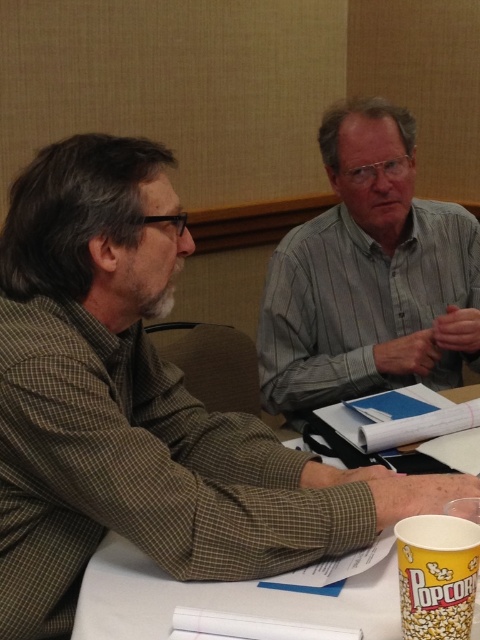
In the scene shown: Who is more distant from viewer, (273, 593) or (468, 627)?

Point (273, 593)

Is point (87, 636) more distant than point (447, 538)?

Yes.

Does point (98, 602) come farther from viewer compared to point (427, 600)?

Yes, it is.

Identify the location of white paper at center. (228, 596).

Can you confirm if gray striped shirt at upper right is wider than white paper at center?

Yes, gray striped shirt at upper right is wider than white paper at center.

Between gray striped shirt at upper right and white paper at center, which one appears on the left side from the viewer's perspective?

From the viewer's perspective, white paper at center appears more on the left side.

Between point (447, 246) and point (242, 604), which one is positioned in front?

Point (242, 604) is in front.

You are a GUI agent. You are given a task and a screenshot of the screen. Output one action in this format:
    pyautogui.click(x=<x>, y=<y>)
    Task: Click on the gray striped shirt at upper right
    The height and width of the screenshot is (640, 480).
    Given the screenshot: What is the action you would take?
    [370, 275]

Can you confirm if gray striped shirt at upper right is thinner than yellow paper cup at lower right?

Incorrect, gray striped shirt at upper right's width is not less than yellow paper cup at lower right's.

Is gray striped shirt at upper right positioned behind yellow paper cup at lower right?

Yes.

Does point (387, 269) come in front of point (403, 560)?

No, it is behind (403, 560).

This screenshot has width=480, height=640. I want to click on gray striped shirt at upper right, so coord(370,275).